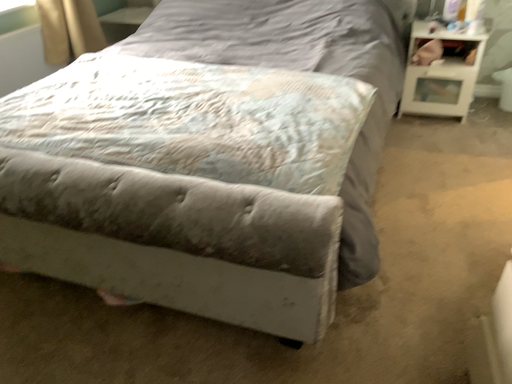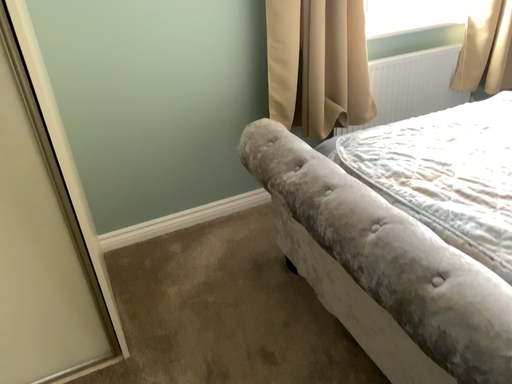
Question: How did the camera likely rotate when shooting the video?

Choices:
 (A) rotated right
 (B) rotated left

Answer: (B)